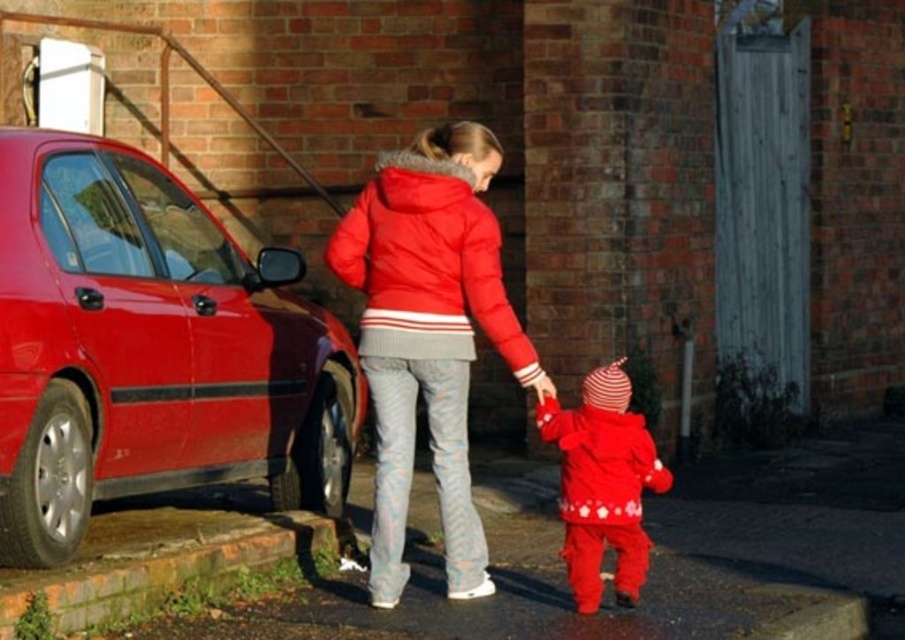
Can you confirm if matte red puffer jacket at center is positioned to the right of puffy red jacket at center?

In fact, matte red puffer jacket at center is to the left of puffy red jacket at center.

Does matte red puffer jacket at center appear over puffy red jacket at center?

No, matte red puffer jacket at center is not above puffy red jacket at center.

Is point (408, 337) positioned behind point (402, 353)?

No.

Identify the location of matte red puffer jacket at center. (427, 333).

Is shiny red car at left to the left of matte red puffer jacket at center from the viewer's perspective?

Indeed, shiny red car at left is positioned on the left side of matte red puffer jacket at center.

Find the location of a particular element. shiny red car at left is located at coordinates (150, 349).

The height and width of the screenshot is (640, 905). Identify the location of shiny red car at left. (150, 349).

In the scene shown: Is shiny red car at left wider than matte red snowsuit at center?

Yes.

Does shiny red car at left appear on the right side of matte red snowsuit at center?

Incorrect, shiny red car at left is not on the right side of matte red snowsuit at center.

The height and width of the screenshot is (640, 905). I want to click on shiny red car at left, so click(x=150, y=349).